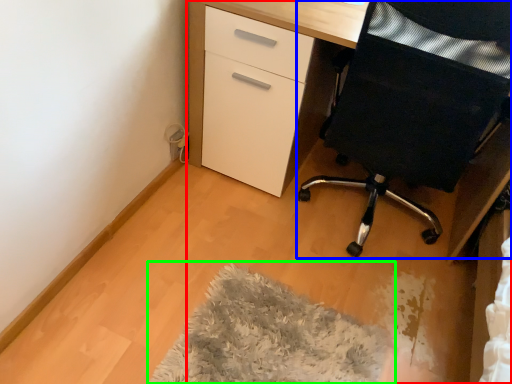
Question: Which is nearer to the desk (highlighted by a red box)? furniture (highlighted by a blue box) or mat (highlighted by a green box).

Choices:
 (A) furniture
 (B) mat

Answer: (A)